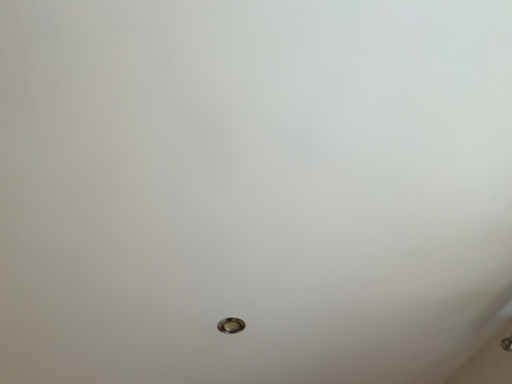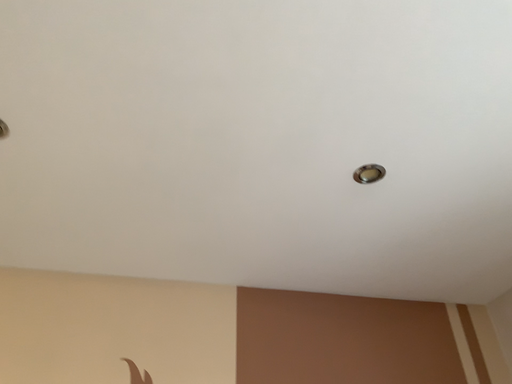
Question: Which way did the camera rotate in the video?

Choices:
 (A) rotated upward
 (B) rotated downward

Answer: (B)